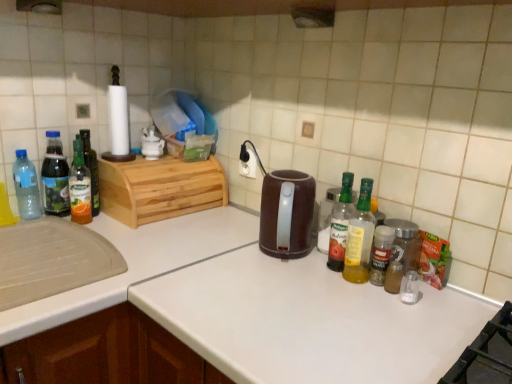
At what (x,y) coordinates should I click in order to perform the action: click on translucent glass spice jar at center-right, which is counted as the seventh bottle, starting from the left. Please return your answer as a coordinate pair (x, y). The width and height of the screenshot is (512, 384). Looking at the image, I should click on (381, 254).

Describe the element at coordinates (80, 186) in the screenshot. The height and width of the screenshot is (384, 512). I see `translucent glass bottle at left, marked as the fourth bottle in a left-to-right arrangement` at that location.

From the picture: Measure the distance between brown plastic kettle at center and camera.

The distance of brown plastic kettle at center from camera is 3.51 feet.

Where is `transparent plastic bottle at left, the eighth bottle viewed from the right`? This screenshot has width=512, height=384. transparent plastic bottle at left, the eighth bottle viewed from the right is located at coordinates (26, 187).

The height and width of the screenshot is (384, 512). I want to click on translucent plastic bottle at right, which ranks as the sixth bottle in left-to-right order, so click(360, 237).

What do you see at coordinates (340, 224) in the screenshot? The width and height of the screenshot is (512, 384). I see `yellow translucent bottle at right, arranged as the fourth bottle when viewed from the right` at bounding box center [340, 224].

Locate an element on the screen. translucent glass spice jar at center-right, the second bottle viewed from the right is located at coordinates (381, 254).

From the image's perspective, between translucent glass bottle at left, marked as the 7th bottle in a right-to-left arrangement, and translucent glass bottle at left, marked as the fourth bottle in a left-to-right arrangement, who is located below?

translucent glass bottle at left, marked as the fourth bottle in a left-to-right arrangement.

Which of these two, translucent glass bottle at left, marked as the 7th bottle in a right-to-left arrangement, or translucent glass bottle at left, which is counted as the 5th bottle, starting from the right, is thinner?

translucent glass bottle at left, which is counted as the 5th bottle, starting from the right, is thinner.

Locate an element on the screen. This screenshot has width=512, height=384. the 2nd bottle positioned below the translucent glass bottle at left, marked as the 7th bottle in a right-to-left arrangement (from the image's perspective) is located at coordinates (80, 186).

How distant is yellow translucent bottle at right, arranged as the fourth bottle when viewed from the right, from translucent glass bottle at left, marked as the 7th bottle in a right-to-left arrangement?

32.73 inches.

Where is `the 4th bottle in front of the translucent glass bottle at left, which is counted as the 2th bottle, starting from the left, counting from the anchor's position`? The height and width of the screenshot is (384, 512). the 4th bottle in front of the translucent glass bottle at left, which is counted as the 2th bottle, starting from the left, counting from the anchor's position is located at coordinates (340, 224).

Does point (347, 219) lie in front of point (47, 166)?

Yes, point (347, 219) is closer to viewer.

From a real-world perspective, which object rests below the other?

From a 3D spatial view, yellow translucent bottle at right, the fifth bottle in the left-to-right sequence, is below.

Does translucent plastic bottle at right, which is the third bottle in right-to-left order, have a lesser height compared to clear glass spice jar at right, positioned as the first bottle in right-to-left order?

No, translucent plastic bottle at right, which is the third bottle in right-to-left order, is not shorter than clear glass spice jar at right, positioned as the first bottle in right-to-left order.

Could you tell me if translucent plastic bottle at right, which is the third bottle in right-to-left order, is turned towards clear glass spice jar at right, positioned as the first bottle in right-to-left order?

No, translucent plastic bottle at right, which is the third bottle in right-to-left order, does not turn towards clear glass spice jar at right, positioned as the first bottle in right-to-left order.

From the image's perspective, which one is positioned higher, translucent plastic bottle at right, which is the third bottle in right-to-left order, or clear glass spice jar at right, positioned as the first bottle in right-to-left order?

translucent plastic bottle at right, which is the third bottle in right-to-left order, is shown above in the image.

Considering the sizes of translucent glass bottle at left, arranged as the 6th bottle when viewed from the right, and translucent glass bottle at left, marked as the 7th bottle in a right-to-left arrangement, in the image, is translucent glass bottle at left, arranged as the 6th bottle when viewed from the right, wider or thinner than translucent glass bottle at left, marked as the 7th bottle in a right-to-left arrangement,?

Clearly, translucent glass bottle at left, arranged as the 6th bottle when viewed from the right, has less width compared to translucent glass bottle at left, marked as the 7th bottle in a right-to-left arrangement.

This screenshot has height=384, width=512. What are the coordinates of `bottle behind the translucent glass bottle at left, which is counted as the 2th bottle, starting from the left` in the screenshot? It's located at click(x=91, y=169).

From the image's perspective, is translucent glass bottle at left, arranged as the third bottle when viewed from the left, above or below translucent glass bottle at left, which is counted as the 2th bottle, starting from the left?

From the image's perspective, translucent glass bottle at left, arranged as the third bottle when viewed from the left, appears below translucent glass bottle at left, which is counted as the 2th bottle, starting from the left.

Would you say translucent glass bottle at left, which is counted as the 2th bottle, starting from the left, is part of translucent glass bottle at left, arranged as the third bottle when viewed from the left,'s contents?

That's incorrect, translucent glass bottle at left, which is counted as the 2th bottle, starting from the left, is not inside translucent glass bottle at left, arranged as the third bottle when viewed from the left.

Does translucent glass bottle at left, marked as the fourth bottle in a left-to-right arrangement, turn towards translucent glass bottle at left, arranged as the third bottle when viewed from the left?

No, translucent glass bottle at left, marked as the fourth bottle in a left-to-right arrangement, is not aimed at translucent glass bottle at left, arranged as the third bottle when viewed from the left.

From a real-world perspective, is translucent glass bottle at left, marked as the fourth bottle in a left-to-right arrangement, physically below translucent glass bottle at left, arranged as the third bottle when viewed from the left?

Yes, from a real-world perspective, translucent glass bottle at left, marked as the fourth bottle in a left-to-right arrangement, is beneath translucent glass bottle at left, arranged as the third bottle when viewed from the left.

Which is less distant, (82, 179) or (95, 205)?

Point (82, 179) is positioned closer to the camera compared to point (95, 205).

Is translucent glass bottle at left, which is counted as the 5th bottle, starting from the right, far away from translucent glass bottle at left, arranged as the 6th bottle when viewed from the right?

No, translucent glass bottle at left, which is counted as the 5th bottle, starting from the right, is not far away from translucent glass bottle at left, arranged as the 6th bottle when viewed from the right.

Would you consider translucent glass bottle at left, marked as the 7th bottle in a right-to-left arrangement, to be distant from yellow translucent bottle at right, arranged as the fourth bottle when viewed from the right?

translucent glass bottle at left, marked as the 7th bottle in a right-to-left arrangement, is actually quite close to yellow translucent bottle at right, arranged as the fourth bottle when viewed from the right.

Is translucent glass bottle at left, marked as the 7th bottle in a right-to-left arrangement, to the left or to the right of yellow translucent bottle at right, the fifth bottle in the left-to-right sequence, in the image?

translucent glass bottle at left, marked as the 7th bottle in a right-to-left arrangement, is positioned on yellow translucent bottle at right, the fifth bottle in the left-to-right sequence,'s left side.

From the yellow translucent bottle at right, arranged as the fourth bottle when viewed from the right, count 4th bottles backward and point to it. Please provide its 2D coordinates.

[(55, 177)]

Which of these two, clear glass spice jar at right, positioned as the first bottle in right-to-left order, or transparent plastic bottle at left, the eighth bottle viewed from the right, is smaller?

clear glass spice jar at right, positioned as the first bottle in right-to-left order, is smaller.

Which point is more distant from viewer, [403,256] or [26,212]?

The point [26,212] is more distant.

Who is shorter, clear glass spice jar at right, positioned as the first bottle in right-to-left order, or transparent plastic bottle at left, the eighth bottle viewed from the right?

clear glass spice jar at right, positioned as the first bottle in right-to-left order, is shorter.

From the image's perspective, which bottle is the 2nd one above the translucent glass bottle at left, marked as the fourth bottle in a left-to-right arrangement? Please provide its 2D coordinates.

[(55, 177)]

Identify the location of the 4th bottle in front of the translucent glass bottle at left, which is counted as the 2th bottle, starting from the left. Image resolution: width=512 pixels, height=384 pixels. (340, 224).

Based on the photo, based on their spatial positions, is translucent glass bottle at left, arranged as the 6th bottle when viewed from the right, or yellow translucent bottle at right, arranged as the fourth bottle when viewed from the right, closer to transparent plastic bottle at left, the eighth bottle viewed from the right?

translucent glass bottle at left, arranged as the 6th bottle when viewed from the right, is closer to transparent plastic bottle at left, the eighth bottle viewed from the right.

Looking at the image, which one is located closer to translucent plastic spice container at right, translucent glass bottle at left, which is counted as the 2th bottle, starting from the left, or transparent plastic bottle at left, the eighth bottle viewed from the right?

Based on the image, translucent glass bottle at left, which is counted as the 2th bottle, starting from the left, appears to be nearer to translucent plastic spice container at right.

Estimate the real-world distances between objects in this image. Which object is closer to transparent plastic bottle at left, the eighth bottle viewed from the right, clear glass spice jar at right, positioned as the first bottle in right-to-left order, or translucent plastic bottle at right, which ranks as the sixth bottle in left-to-right order?

Based on the image, translucent plastic bottle at right, which ranks as the sixth bottle in left-to-right order, appears to be nearer to transparent plastic bottle at left, the eighth bottle viewed from the right.

Which object lies further to the anchor point translucent plastic bottle at right, which ranks as the sixth bottle in left-to-right order, brown plastic kettle at center or translucent glass bottle at left, marked as the 7th bottle in a right-to-left arrangement?

Based on the image, translucent glass bottle at left, marked as the 7th bottle in a right-to-left arrangement, appears to be further to translucent plastic bottle at right, which ranks as the sixth bottle in left-to-right order.

Based on their spatial positions, is translucent plastic bottle at right, which ranks as the sixth bottle in left-to-right order, or translucent glass bottle at left, arranged as the 6th bottle when viewed from the right, closer to yellow translucent bottle at right, the fifth bottle in the left-to-right sequence?

translucent plastic bottle at right, which ranks as the sixth bottle in left-to-right order.

Based on their spatial positions, is translucent glass bottle at left, which is counted as the 2th bottle, starting from the left, or clear glass spice jar at right, positioned as the first bottle in right-to-left order, closer to translucent glass bottle at left, marked as the fourth bottle in a left-to-right arrangement?

translucent glass bottle at left, which is counted as the 2th bottle, starting from the left.

Looking at the image, which one is located closer to translucent glass spice jar at center-right, the second bottle viewed from the right, translucent glass bottle at left, marked as the fourth bottle in a left-to-right arrangement, or yellow translucent bottle at right, the fifth bottle in the left-to-right sequence?

The object closer to translucent glass spice jar at center-right, the second bottle viewed from the right, is yellow translucent bottle at right, the fifth bottle in the left-to-right sequence.

When comparing their distances from clear glass spice jar at right, positioned as the first bottle in right-to-left order, does translucent plastic bottle at right, which is the third bottle in right-to-left order, or brown plastic kettle at center seem further?

brown plastic kettle at center.

Identify the location of home appliance situated between translucent glass bottle at left, arranged as the third bottle when viewed from the left, and yellow translucent bottle at right, the fifth bottle in the left-to-right sequence, from left to right. (286, 214).

The image size is (512, 384). What are the coordinates of `bottle between translucent glass bottle at left, marked as the 7th bottle in a right-to-left arrangement, and translucent glass bottle at left, marked as the fourth bottle in a left-to-right arrangement, in the horizontal direction` in the screenshot? It's located at (91, 169).

I want to click on home appliance between translucent glass bottle at left, marked as the fourth bottle in a left-to-right arrangement, and translucent glass spice jar at center-right, the second bottle viewed from the right, in the horizontal direction, so click(x=286, y=214).

Where is `bottle between translucent glass bottle at left, marked as the fourth bottle in a left-to-right arrangement, and translucent plastic bottle at right, which ranks as the sixth bottle in left-to-right order, from left to right`? The height and width of the screenshot is (384, 512). bottle between translucent glass bottle at left, marked as the fourth bottle in a left-to-right arrangement, and translucent plastic bottle at right, which ranks as the sixth bottle in left-to-right order, from left to right is located at coordinates (340, 224).